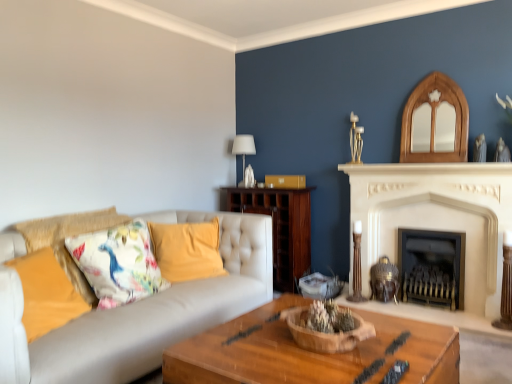
Question: From a real-world perspective, is black metal fireplace at center, arranged as the 1th fireplace when viewed from the right, physically below wooden bowl at center?

Choices:
 (A) yes
 (B) no

Answer: (A)

Question: Is black metal fireplace at center, which appears as the 2th fireplace when viewed from the left, in front of wooden bowl at center?

Choices:
 (A) no
 (B) yes

Answer: (A)

Question: From the image's perspective, does black metal fireplace at center, arranged as the 1th fireplace when viewed from the right, appear higher than wooden bowl at center?

Choices:
 (A) yes
 (B) no

Answer: (B)

Question: From the image's perspective, would you say black metal fireplace at center, arranged as the 1th fireplace when viewed from the right, is shown under wooden bowl at center?

Choices:
 (A) yes
 (B) no

Answer: (A)

Question: Does black metal fireplace at center, arranged as the 1th fireplace when viewed from the right, have a lesser height compared to wooden bowl at center?

Choices:
 (A) no
 (B) yes

Answer: (A)

Question: From a real-world perspective, relative to wooden bowl at center, is white marble fireplace at upper center vertically above or below?

Choices:
 (A) below
 (B) above

Answer: (B)

Question: Is white marble fireplace at upper center taller or shorter than wooden bowl at center?

Choices:
 (A) tall
 (B) short

Answer: (B)

Question: Does point tap(364, 170) appear closer or farther from the camera than point tap(326, 347)?

Choices:
 (A) farther
 (B) closer

Answer: (A)

Question: Looking at their shapes, would you say white marble fireplace at upper center is wider or thinner than wooden bowl at center?

Choices:
 (A) thin
 (B) wide

Answer: (A)

Question: In terms of width, does white stone fireplace at center, the 2th fireplace positioned from the right, look wider or thinner when compared to floral fabric cushion at left?

Choices:
 (A) wide
 (B) thin

Answer: (B)

Question: Is white stone fireplace at center, the first fireplace positioned from the left, taller or shorter than floral fabric cushion at left?

Choices:
 (A) tall
 (B) short

Answer: (A)

Question: Is white stone fireplace at center, the 2th fireplace positioned from the right, bigger or smaller than floral fabric cushion at left?

Choices:
 (A) small
 (B) big

Answer: (B)

Question: Would you say white stone fireplace at center, the first fireplace positioned from the left, is to the left or to the right of floral fabric cushion at left in the picture?

Choices:
 (A) right
 (B) left

Answer: (A)

Question: Considering the relative positions of wooden bowl at center and white fabric lampshade at upper center in the image provided, is wooden bowl at center to the left or to the right of white fabric lampshade at upper center?

Choices:
 (A) left
 (B) right

Answer: (B)

Question: In the image, is wooden bowl at center positioned in front of or behind white fabric lampshade at upper center?

Choices:
 (A) front
 (B) behind

Answer: (A)